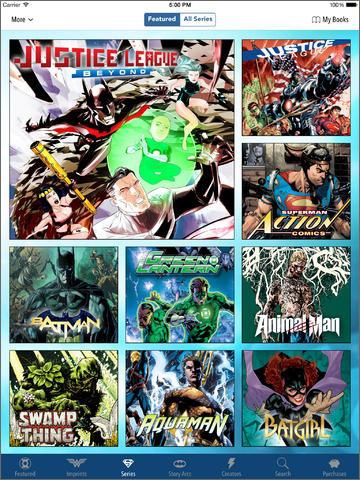
Where is `dark blue bar`? This screenshot has width=360, height=480. dark blue bar is located at coordinates (208, 469).